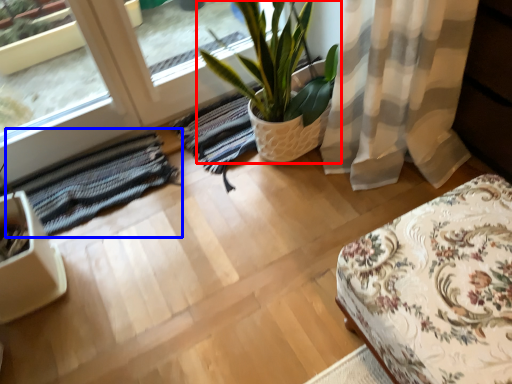
Question: Which object appears closest to the camera in this image, houseplant (highlighted by a red box) or mat (highlighted by a blue box)?

Choices:
 (A) houseplant
 (B) mat

Answer: (A)